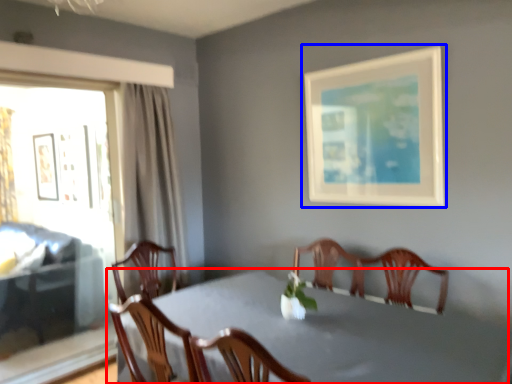
Question: Which object appears closest to the camera in this image, table (highlighted by a red box) or picture frame (highlighted by a blue box)?

Choices:
 (A) table
 (B) picture frame

Answer: (A)